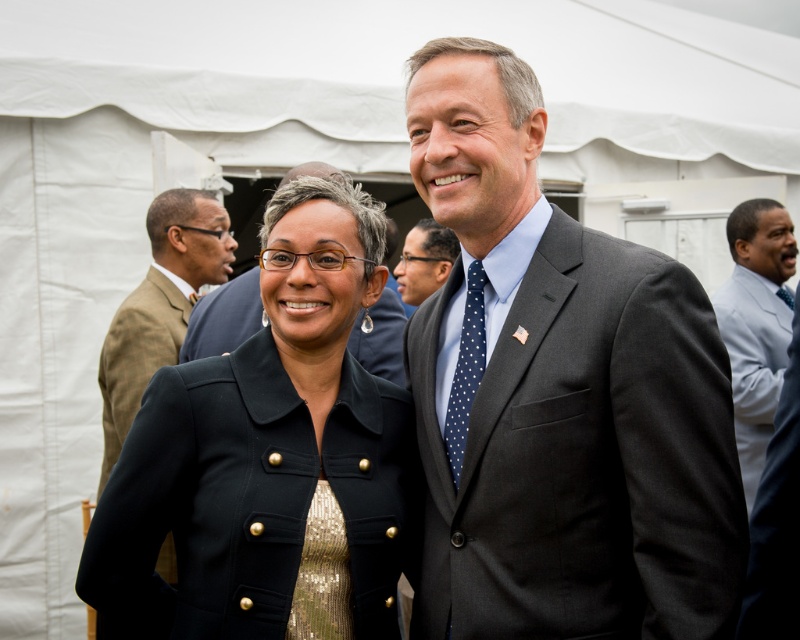
Question: Considering the relative positions of black sequined dress at center and blue dotted tie at center in the image provided, where is black sequined dress at center located with respect to blue dotted tie at center?

Choices:
 (A) above
 (B) below

Answer: (B)

Question: Which of these objects is positioned farthest from the light blue shirt at right?

Choices:
 (A) gold sequined dress at center
 (B) dark gray suit at center
 (C) black sequined dress at center

Answer: (A)

Question: Estimate the real-world distances between objects in this image. Which object is farther from the gold sequined dress at center?

Choices:
 (A) light blue shirt at right
 (B) black matte jacket at center

Answer: (A)

Question: Does gold sequined dress at center have a lesser width compared to polka dot tie at center?

Choices:
 (A) yes
 (B) no

Answer: (A)

Question: Can you confirm if light blue shirt at right is thinner than blue dotted tie at center?

Choices:
 (A) yes
 (B) no

Answer: (B)

Question: Which object appears closest to the camera in this image?

Choices:
 (A) gold sequined dress at center
 (B) black sequined dress at center
 (C) dark gray suit at center
 (D) polka dot tie at center

Answer: (C)